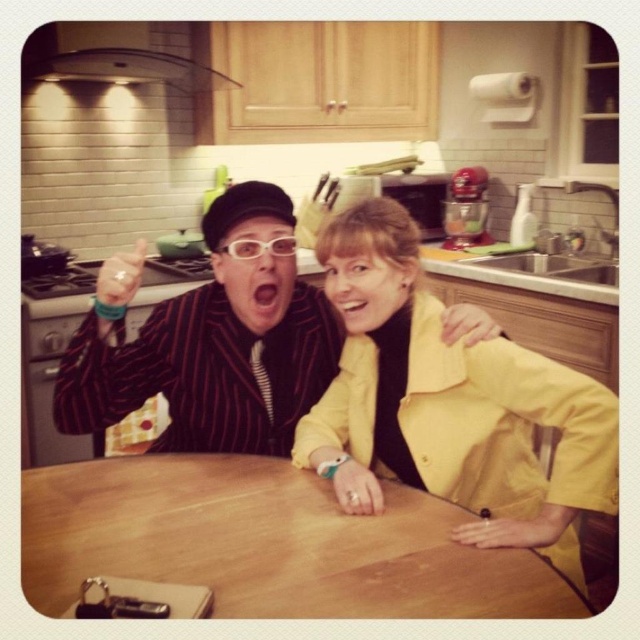
Question: Does wooden table at center have a greater width compared to striped fabric suit at center?

Choices:
 (A) yes
 (B) no

Answer: (A)

Question: Estimate the real-world distances between objects in this image. Which object is farther from the yellow matte jacket at center?

Choices:
 (A) striped fabric suit at center
 (B) wooden table at center

Answer: (B)

Question: Which object is positioned closest to the striped fabric suit at center?

Choices:
 (A) wooden table at center
 (B) yellow matte jacket at center

Answer: (B)

Question: Can you confirm if wooden table at center is wider than striped fabric suit at center?

Choices:
 (A) yes
 (B) no

Answer: (A)

Question: Which point appears farthest from the camera in this image?

Choices:
 (A) (196, 548)
 (B) (310, 317)

Answer: (B)

Question: Is yellow matte jacket at center smaller than striped fabric suit at center?

Choices:
 (A) no
 (B) yes

Answer: (A)